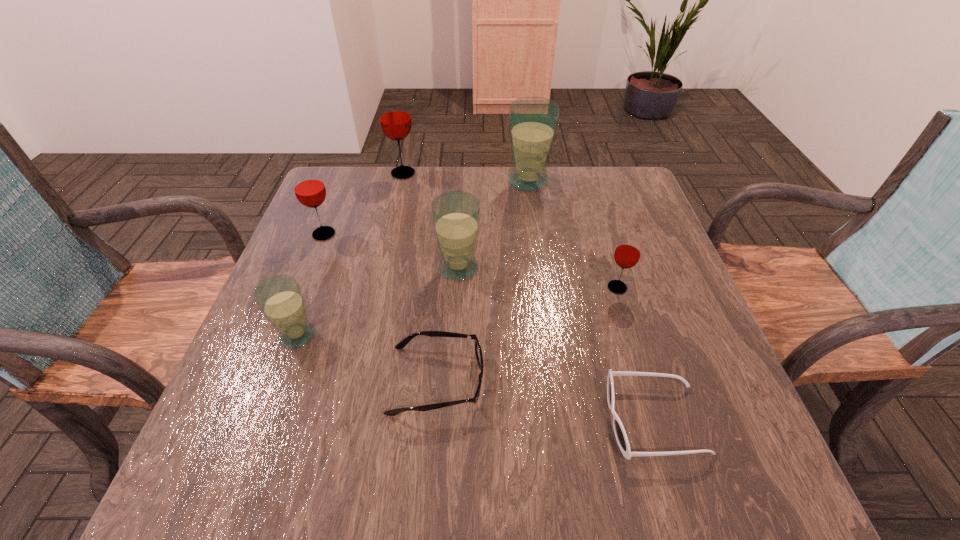
Identify the location of blue glass that is the closest to the second smallest red glass. This screenshot has height=540, width=960. (280, 298).

In order to click on blue glass object that ranks as the second closest to the farthest red glass in this screenshot , I will do `click(455, 215)`.

Identify the location of free region that satisfies the following two spatial constraints: 1. on the front side of the third glass from left to right; 2. on the left side of the rightmost glass. This screenshot has width=960, height=540. (377, 287).

Locate an element on the screen. Image resolution: width=960 pixels, height=540 pixels. vacant point that satisfies the following two spatial constraints: 1. on the front side of the second biggest blue glass; 2. on the right side of the biggest red glass is located at coordinates (381, 268).